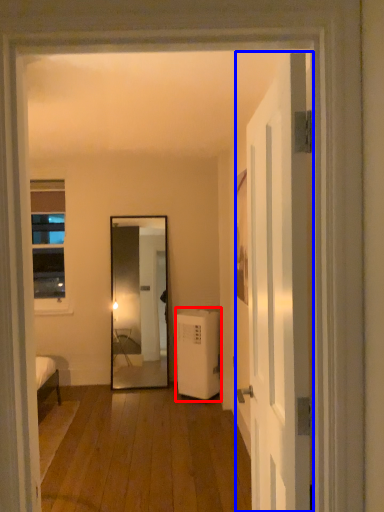
Question: Which object appears farthest to the camera in this image, air conditioner (highlighted by a red box) or door (highlighted by a blue box)?

Choices:
 (A) air conditioner
 (B) door

Answer: (A)